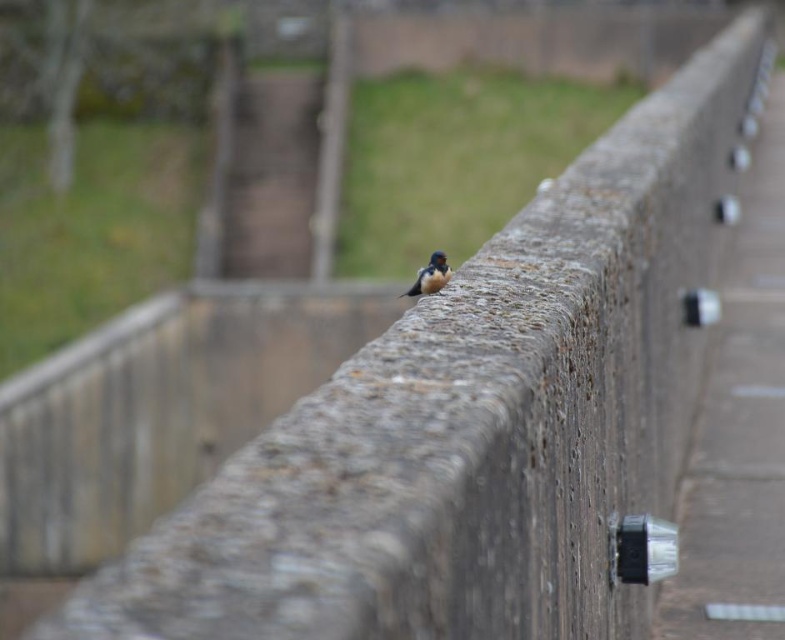
Question: Is concrete at right above satin plumage bird at center?

Choices:
 (A) no
 (B) yes

Answer: (B)

Question: Which point is closer to the camera?

Choices:
 (A) (739, 225)
 (B) (422, 273)

Answer: (B)

Question: Among these points, which one is nearest to the camera?

Choices:
 (A) (448, 268)
 (B) (769, 509)

Answer: (A)

Question: Does concrete at right appear under satin plumage bird at center?

Choices:
 (A) yes
 (B) no

Answer: (B)

Question: Can you confirm if concrete at right is positioned below satin plumage bird at center?

Choices:
 (A) yes
 (B) no

Answer: (B)

Question: Which point is farther to the camera?

Choices:
 (A) (425, 285)
 (B) (692, 499)

Answer: (B)